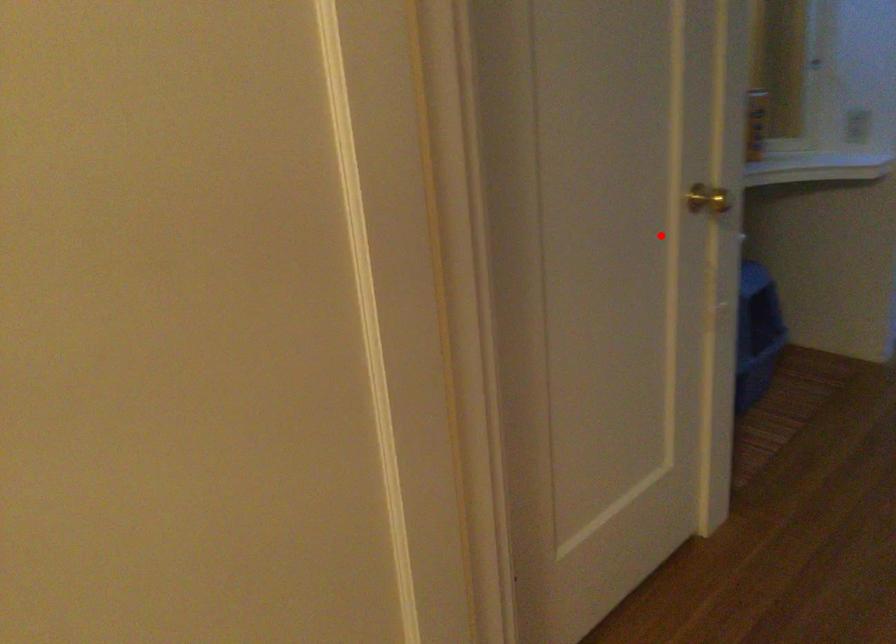
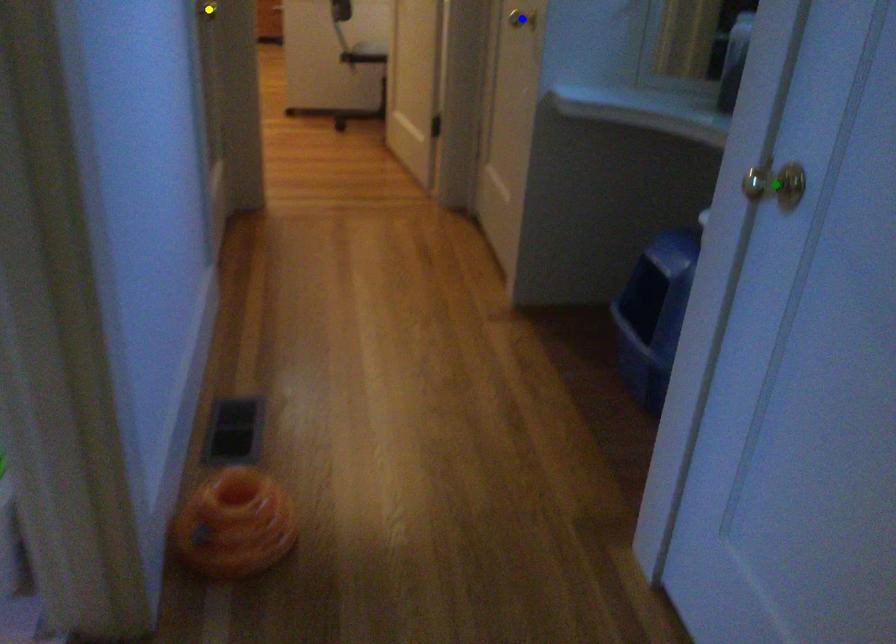
Question: I am providing you with two images of the same scene from different viewpoints. A red point is marked on the first image. You are given multiple points on the second image. Which mark in image 2 goes with the point in image 1?

Choices:
 (A) green point
 (B) blue point
 (C) yellow point

Answer: (B)